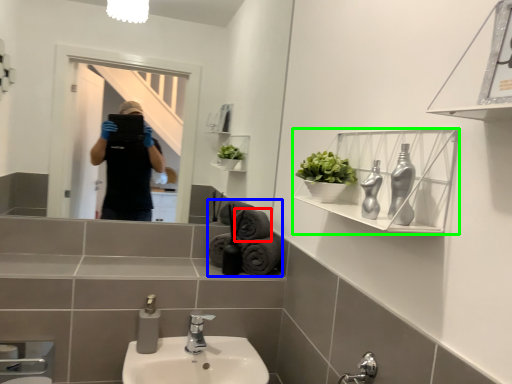
Question: Which is nearer to the bath towel (highlighted by a red box)? bath towel (highlighted by a blue box) or shelf (highlighted by a green box).

Choices:
 (A) bath towel
 (B) shelf

Answer: (A)